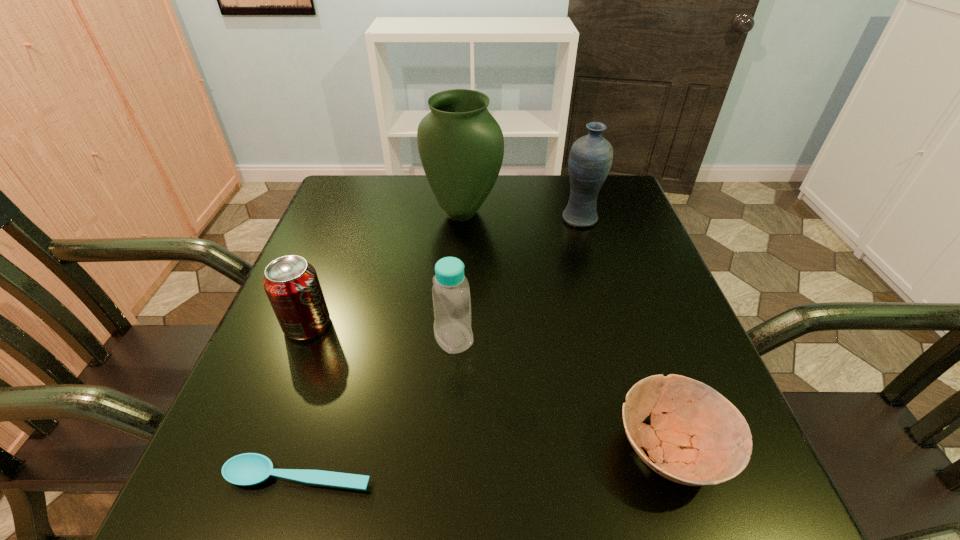
Find the location of a particular element. Image resolution: width=960 pixels, height=540 pixels. free point between the second shortest object and the shorter vase is located at coordinates (626, 334).

Locate an element on the screen. This screenshot has width=960, height=540. unoccupied area between the shorter vase and the shortest object is located at coordinates (440, 348).

Identify the location of vacant space that is in between the third tallest object and the soda can. [380, 332].

Where is `vacant area that lies between the fifth tallest object and the fourth tallest object`? This screenshot has height=540, width=960. vacant area that lies between the fifth tallest object and the fourth tallest object is located at coordinates (490, 387).

Image resolution: width=960 pixels, height=540 pixels. Identify the location of free space between the bottle and the fourth tallest object. (380, 332).

The height and width of the screenshot is (540, 960). I want to click on free space that is in between the fourth tallest object and the bottle, so (x=380, y=332).

Find the location of a particular element. This screenshot has width=960, height=540. object that can be found as the fourth closest to the fourth shortest object is located at coordinates (461, 146).

You are a GUI agent. You are given a task and a screenshot of the screen. Output one action in this format:
    pyautogui.click(x=<x>, y=<y>)
    Task: Click on the object that stands as the fifth closest to the bottle
    The width and height of the screenshot is (960, 540).
    Given the screenshot: What is the action you would take?
    pyautogui.click(x=590, y=159)

This screenshot has width=960, height=540. I want to click on free location that satisfies the following two spatial constraints: 1. on the back side of the fourth shortest object; 2. on the left side of the shortest object, so click(x=341, y=338).

The image size is (960, 540). What are the coordinates of `free space that satisfies the following two spatial constraints: 1. on the back side of the spoon; 2. on the left side of the left vase` in the screenshot? It's located at (378, 213).